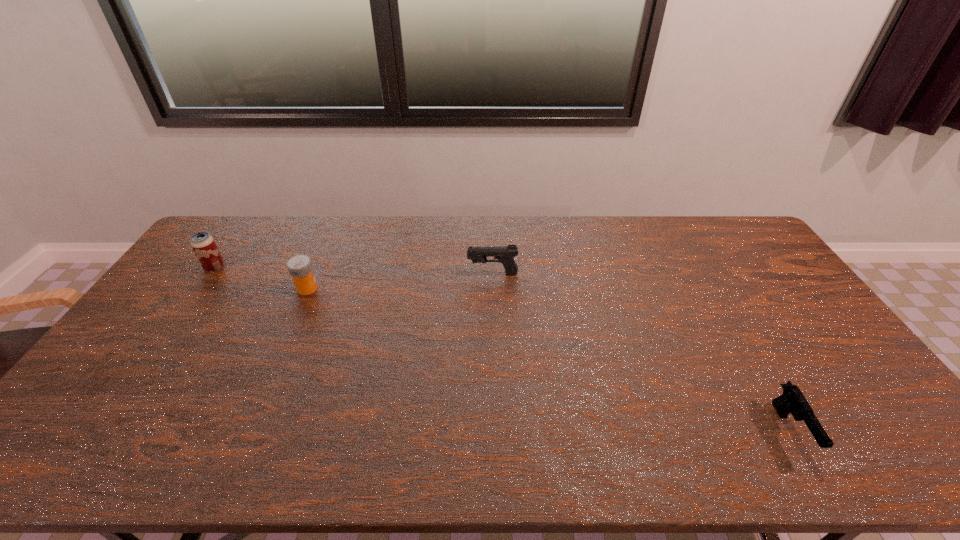
Identify the location of vacant region located at the barrel of the farther pistol. pos(429,274).

The height and width of the screenshot is (540, 960). Find the location of `vacant area situated 0.150m on the label side of the third farthest object`. vacant area situated 0.150m on the label side of the third farthest object is located at coordinates (365, 288).

This screenshot has width=960, height=540. I want to click on object positioned at the near edge, so click(x=792, y=400).

Where is `object positioned at the left edge`? This screenshot has height=540, width=960. object positioned at the left edge is located at coordinates (203, 245).

In the image, there is a desktop. Identify the location of free region at the far edge. This screenshot has height=540, width=960. (323, 228).

I want to click on vacant space at the left edge of the desktop, so click(154, 325).

In order to click on vacant space at the right edge of the desktop in this screenshot , I will do `click(758, 267)`.

Find the location of `vacant region between the leftmost object and the rightmost object`. vacant region between the leftmost object and the rightmost object is located at coordinates (503, 349).

Identify the location of blank region between the beer can and the third object from left to right. This screenshot has width=960, height=540. (353, 271).

At what (x,y) coordinates should I click in order to perform the action: click on vacant space that is in between the right pistol and the second nearest object. Please return your answer as a coordinate pair (x, y). This screenshot has width=960, height=540. Looking at the image, I should click on (549, 359).